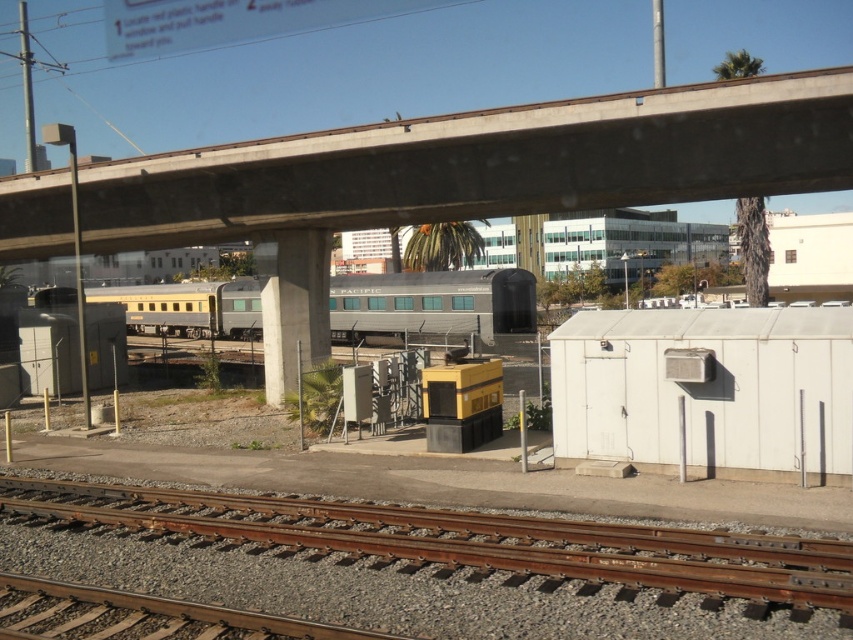
The width and height of the screenshot is (853, 640). In order to click on brown wooden track at lower center in this screenshot , I will do pyautogui.click(x=469, y=541).

Where is `brown wooden track at lower center`? brown wooden track at lower center is located at coordinates (469, 541).

Which is more to the left, concrete at upper center or brown wooden track at lower center?

concrete at upper center

Is point (132, 188) positioned after point (735, 532)?

Yes, it is behind point (735, 532).

Between point (805, 144) and point (9, 490), which one is positioned behind?

The point (805, 144) is behind.

This screenshot has height=640, width=853. Find the location of `concrete at upper center`. concrete at upper center is located at coordinates (486, 163).

Where is `concrete at upper center`? The image size is (853, 640). concrete at upper center is located at coordinates (486, 163).

Image resolution: width=853 pixels, height=640 pixels. What are the coordinates of `concrete at upper center` in the screenshot? It's located at (486, 163).

This screenshot has height=640, width=853. Identify the location of concrete at upper center. (486, 163).